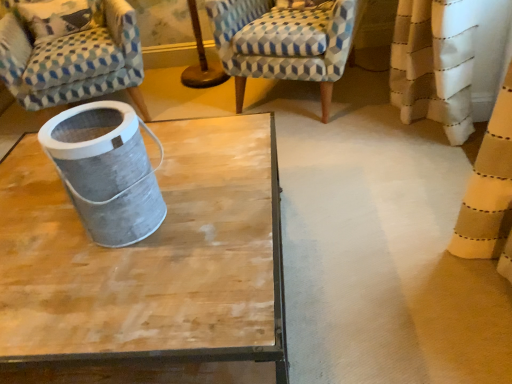
Question: Considering the relative sizes of patterned fabric armchair at upper left, which ranks as the first chair in left-to-right order, and patterned fabric armchair at upper center, marked as the 1th chair in a right-to-left arrangement, in the image provided, is patterned fabric armchair at upper left, which ranks as the first chair in left-to-right order, smaller than patterned fabric armchair at upper center, marked as the 1th chair in a right-to-left arrangement,?

Choices:
 (A) yes
 (B) no

Answer: (B)

Question: Is patterned fabric armchair at upper left, which ranks as the first chair in left-to-right order, turned away from patterned fabric armchair at upper center, marked as the 1th chair in a right-to-left arrangement?

Choices:
 (A) no
 (B) yes

Answer: (A)

Question: Would you say patterned fabric armchair at upper center, marked as the 1th chair in a right-to-left arrangement, is part of patterned fabric armchair at upper left, the 2th chair in the right-to-left sequence,'s contents?

Choices:
 (A) no
 (B) yes

Answer: (A)

Question: From the image's perspective, does patterned fabric armchair at upper left, which ranks as the first chair in left-to-right order, appear higher than patterned fabric armchair at upper center, the second chair when ordered from left to right?

Choices:
 (A) no
 (B) yes

Answer: (A)

Question: From a real-world perspective, is patterned fabric armchair at upper left, the 2th chair in the right-to-left sequence, positioned under patterned fabric armchair at upper center, marked as the 1th chair in a right-to-left arrangement, based on gravity?

Choices:
 (A) yes
 (B) no

Answer: (B)

Question: Is patterned fabric armchair at upper left, which ranks as the first chair in left-to-right order, far away from patterned fabric armchair at upper center, marked as the 1th chair in a right-to-left arrangement?

Choices:
 (A) yes
 (B) no

Answer: (B)

Question: Is patterned fabric armchair at upper center, the second chair when ordered from left to right, shorter than patterned fabric armchair at upper left, the 2th chair in the right-to-left sequence?

Choices:
 (A) no
 (B) yes

Answer: (B)

Question: Does patterned fabric armchair at upper center, marked as the 1th chair in a right-to-left arrangement, appear on the left side of patterned fabric armchair at upper left, which ranks as the first chair in left-to-right order?

Choices:
 (A) no
 (B) yes

Answer: (A)

Question: From the image's perspective, is patterned fabric armchair at upper center, marked as the 1th chair in a right-to-left arrangement, under patterned fabric armchair at upper left, the 2th chair in the right-to-left sequence?

Choices:
 (A) yes
 (B) no

Answer: (B)

Question: Considering the relative sizes of patterned fabric armchair at upper center, marked as the 1th chair in a right-to-left arrangement, and patterned fabric armchair at upper left, the 2th chair in the right-to-left sequence, in the image provided, is patterned fabric armchair at upper center, marked as the 1th chair in a right-to-left arrangement, taller than patterned fabric armchair at upper left, the 2th chair in the right-to-left sequence,?

Choices:
 (A) no
 (B) yes

Answer: (A)

Question: Would you say patterned fabric armchair at upper left, which ranks as the first chair in left-to-right order, is part of patterned fabric armchair at upper center, marked as the 1th chair in a right-to-left arrangement,'s contents?

Choices:
 (A) yes
 (B) no

Answer: (B)

Question: Is patterned fabric armchair at upper center, the second chair when ordered from left to right, wider than patterned fabric armchair at upper left, the 2th chair in the right-to-left sequence?

Choices:
 (A) no
 (B) yes

Answer: (A)

Question: From the image's perspective, relative to patterned fabric armchair at upper center, marked as the 1th chair in a right-to-left arrangement, is patterned fabric armchair at upper left, the 2th chair in the right-to-left sequence, above or below?

Choices:
 (A) below
 (B) above

Answer: (A)